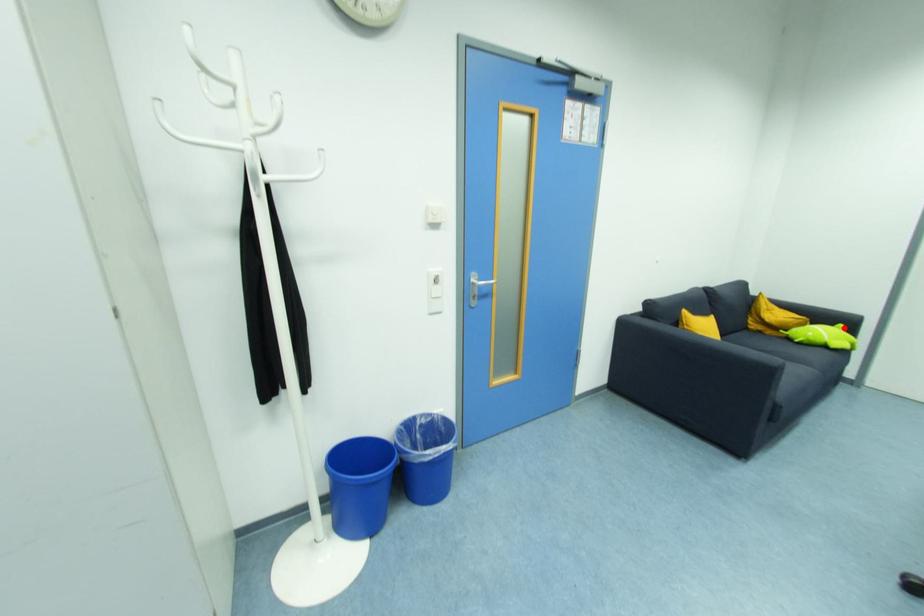
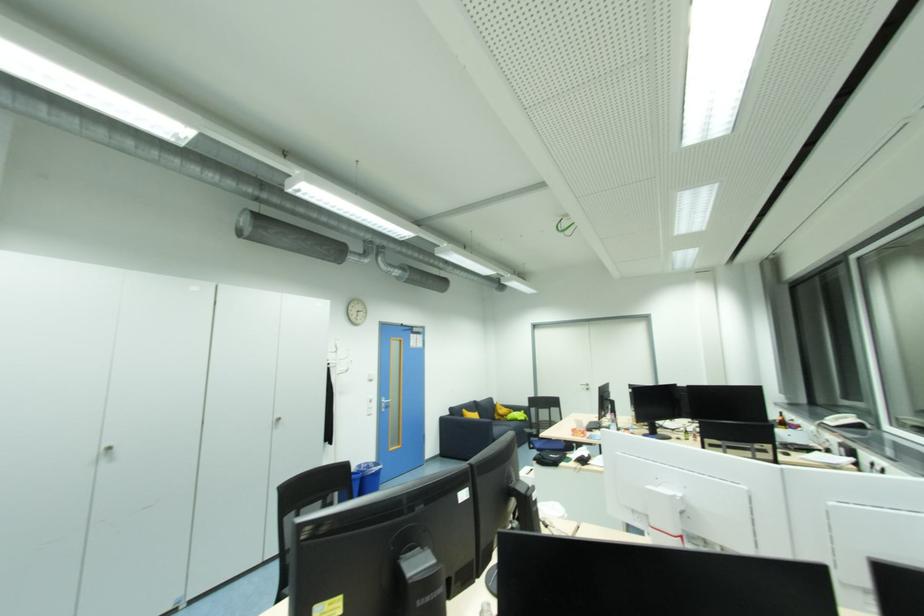
Question: I am providing you with two images of the same scene from different viewpoints. In image1, a red point is highlighted. Considering the same 3D point in image2, which of the following is correct?

Choices:
 (A) It is closer
 (B) It is farther

Answer: (B)